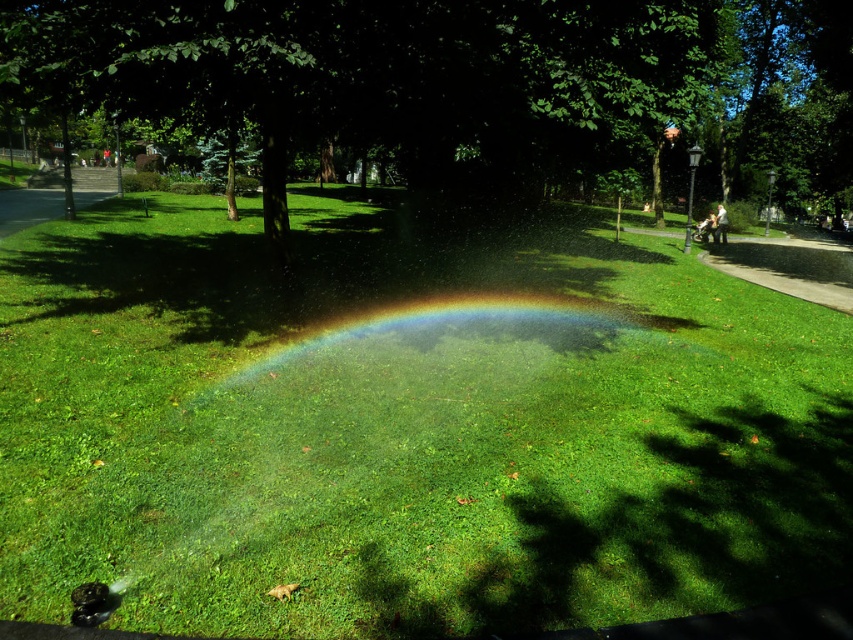
Can you confirm if green grass at center is positioned to the right of green leafy tree at center?

No, green grass at center is not to the right of green leafy tree at center.

What do you see at coordinates (407, 424) in the screenshot? I see `green grass at center` at bounding box center [407, 424].

At what (x,y) coordinates should I click in order to perform the action: click on green grass at center. Please return your answer as a coordinate pair (x, y). Looking at the image, I should click on (407, 424).

Does green grass at center have a larger size compared to rainbow at center?

Yes, green grass at center is bigger than rainbow at center.

Which of these two, green grass at center or rainbow at center, stands shorter?

Standing shorter between the two is rainbow at center.

The image size is (853, 640). Find the location of `green grass at center`. green grass at center is located at coordinates (407, 424).

Does green leafy tree at center appear on the left side of rainbow at center?

No, green leafy tree at center is not to the left of rainbow at center.

What are the coordinates of `green leafy tree at center` in the screenshot? It's located at (465, 86).

Is point (767, 168) more distant than point (589, 316)?

That is True.

The width and height of the screenshot is (853, 640). I want to click on green leafy tree at center, so click(x=465, y=86).